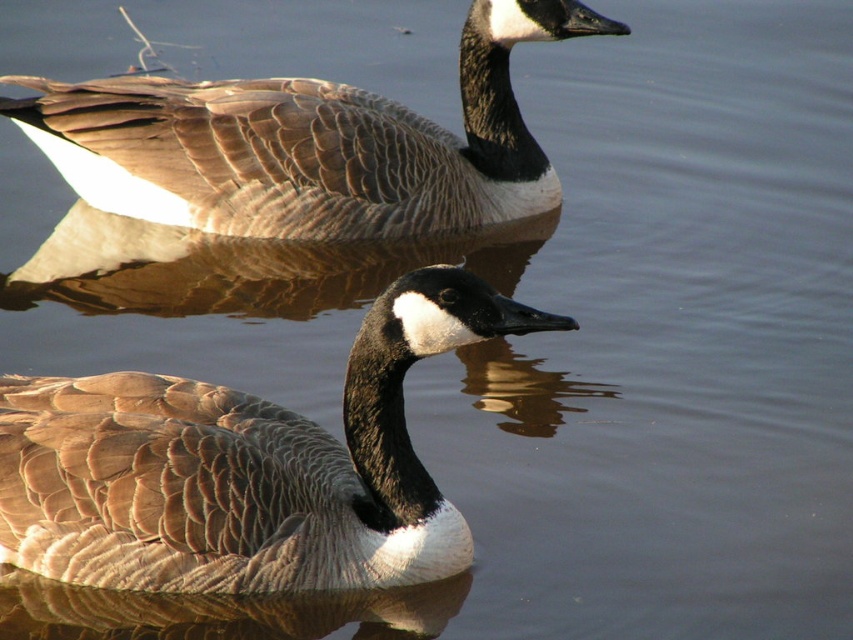
Question: Can you confirm if brown feathered duck at center is wider than brown feathered duck at upper center?

Choices:
 (A) no
 (B) yes

Answer: (A)

Question: In this image, where is brown feathered duck at center located relative to brown feathered duck at upper center?

Choices:
 (A) below
 (B) above

Answer: (A)

Question: Which point is farther to the camera?

Choices:
 (A) brown feathered duck at center
 (B) brown feathered duck at upper center

Answer: (B)

Question: Is brown feathered duck at center above brown feathered duck at upper center?

Choices:
 (A) yes
 (B) no

Answer: (B)